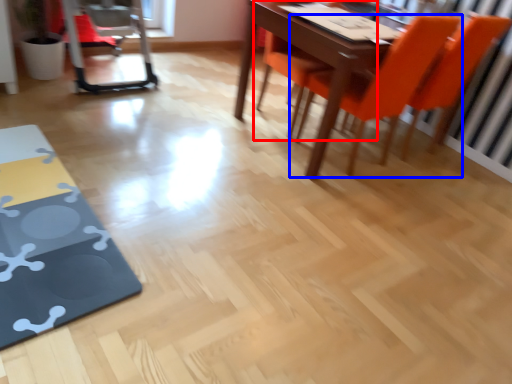
Question: Which object is closer to the camera taking this photo, chair (highlighted by a red box) or chair (highlighted by a blue box)?

Choices:
 (A) chair
 (B) chair

Answer: (B)